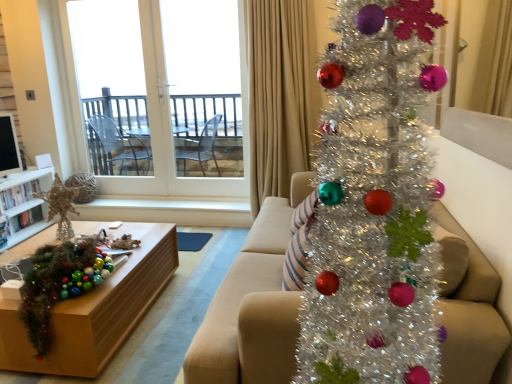
Question: Considering the relative positions of beige fabric curtain at upper right and shiny green tinsel garland at lower left in the image provided, is beige fabric curtain at upper right to the left or to the right of shiny green tinsel garland at lower left?

Choices:
 (A) right
 (B) left

Answer: (A)

Question: From a real-world perspective, is beige fabric curtain at upper right above or below shiny green tinsel garland at lower left?

Choices:
 (A) below
 (B) above

Answer: (B)

Question: Considering the real-world distances, which object is closest to the matte beige couch at center?

Choices:
 (A) wooden table at lower left
 (B) white glass door at upper left
 (C) beige fabric curtain at upper right
 (D) shiny green tinsel garland at lower left

Answer: (A)

Question: Which of these objects is positioned closest to the white glass door at upper left?

Choices:
 (A) wooden table at lower left
 (B) beige fabric curtain at upper right
 (C) matte beige couch at center
 (D) shiny green tinsel garland at lower left

Answer: (B)